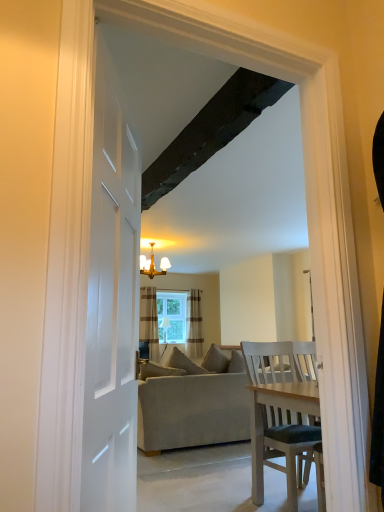
Question: Is clear glass window at center at the back of beige fabric couch at center?

Choices:
 (A) no
 (B) yes

Answer: (A)

Question: Is the depth of beige fabric couch at center less than that of clear glass window at center?

Choices:
 (A) no
 (B) yes

Answer: (B)

Question: From the image's perspective, is beige fabric couch at center above clear glass window at center?

Choices:
 (A) yes
 (B) no

Answer: (B)

Question: Are beige fabric couch at center and clear glass window at center far apart?

Choices:
 (A) no
 (B) yes

Answer: (B)

Question: From the image's perspective, is beige fabric couch at center beneath clear glass window at center?

Choices:
 (A) yes
 (B) no

Answer: (A)

Question: From a real-world perspective, is beige fabric couch at center positioned over clear glass window at center based on gravity?

Choices:
 (A) yes
 (B) no

Answer: (B)

Question: From a real-world perspective, is gold metallic chandelier at upper center below beige fabric couch at center?

Choices:
 (A) yes
 (B) no

Answer: (B)

Question: Considering the relative sizes of gold metallic chandelier at upper center and beige fabric couch at center in the image provided, is gold metallic chandelier at upper center shorter than beige fabric couch at center?

Choices:
 (A) yes
 (B) no

Answer: (A)

Question: Is gold metallic chandelier at upper center bigger than beige fabric couch at center?

Choices:
 (A) no
 (B) yes

Answer: (A)

Question: From the image's perspective, does gold metallic chandelier at upper center appear lower than beige fabric couch at center?

Choices:
 (A) yes
 (B) no

Answer: (B)

Question: Does gold metallic chandelier at upper center contain beige fabric couch at center?

Choices:
 (A) no
 (B) yes

Answer: (A)

Question: Does gold metallic chandelier at upper center have a lesser width compared to beige fabric couch at center?

Choices:
 (A) yes
 (B) no

Answer: (A)

Question: Does beige fabric couch at center have a greater height compared to brown striped curtain at center, acting as the second curtain starting from the right?

Choices:
 (A) no
 (B) yes

Answer: (A)